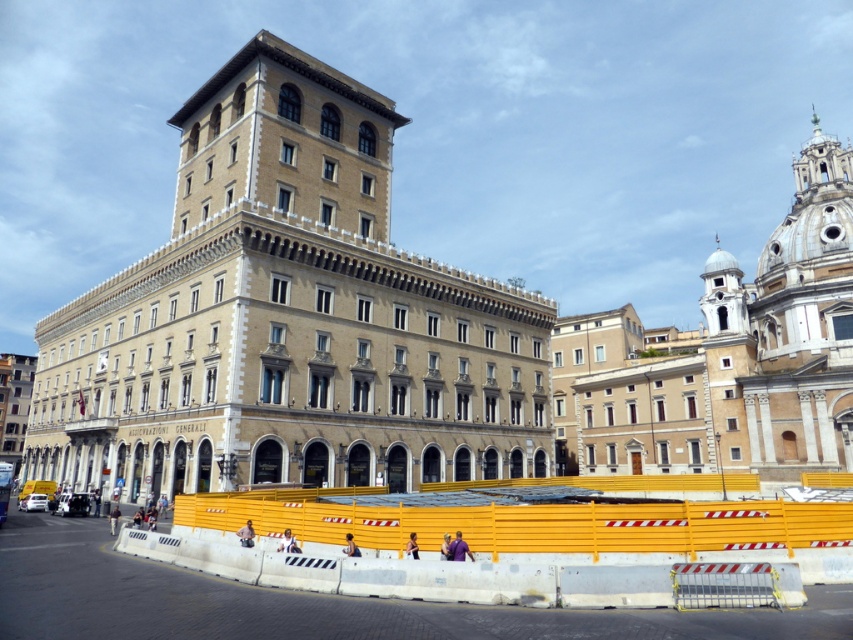
From the picture: You are a photographer standing in the middle of the street. You want to capture both the white marble building at upper right and the yellow plastic barrier at lower center in your shot. Which object will appear taller in the photograph?

A: The white marble building at upper right will appear taller in the photograph because it has a greater height compared to the yellow plastic barrier at lower center.

You are a city planner assessing the urban space in front of the beige stone building at center. The yellow plastic barrier at lower center is currently blocking part of the sidewalk. Considering the width of both structures, which one is wider and might require more space when planning renovations?

The beige stone building at center is wider than the yellow plastic barrier at lower center, so it would require more space during renovations.

You are standing in the city square and see the beige stone building at center and the white marble building at upper right. Which building is closer to you?

The beige stone building at center is closer to you because it is in front of the white marble building at upper right.